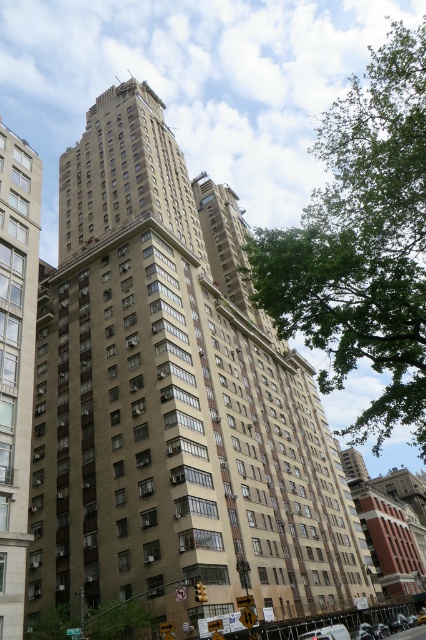
Does brown brick building at center have a larger size compared to green leafy tree at upper right?

Actually, brown brick building at center might be smaller than green leafy tree at upper right.

Where is `brown brick building at center`? brown brick building at center is located at coordinates (172, 401).

Where is `brown brick building at center`? brown brick building at center is located at coordinates (172, 401).

Does brown brick building at center have a lesser width compared to beige concrete building at left?

In fact, brown brick building at center might be wider than beige concrete building at left.

Is brown brick building at center to the left of beige concrete building at left from the viewer's perspective?

No, brown brick building at center is not to the left of beige concrete building at left.

Between point (195, 406) and point (31, 346), which one is positioned behind?

Positioned behind is point (195, 406).

You are a GUI agent. You are given a task and a screenshot of the screen. Output one action in this format:
    pyautogui.click(x=<x>, y=<y>)
    Task: Click on the brown brick building at center
    This screenshot has width=426, height=640.
    Given the screenshot: What is the action you would take?
    pos(172,401)

Does green leafy tree at upper right have a greater height compared to beige concrete building at left?

Indeed, green leafy tree at upper right has a greater height compared to beige concrete building at left.

Describe the element at coordinates (362, 243) in the screenshot. I see `green leafy tree at upper right` at that location.

In order to click on green leafy tree at upper right in this screenshot , I will do `click(362, 243)`.